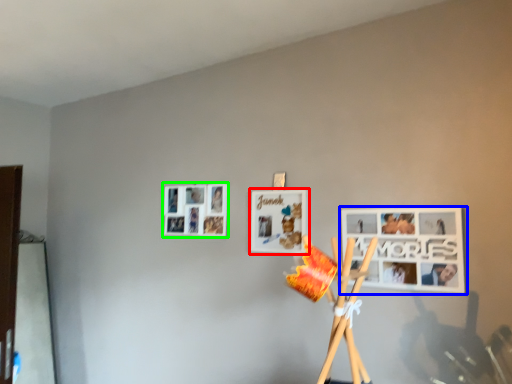
Question: Estimate the real-world distances between objects in this image. Which object is farther from picture frame (highlighted by a red box), picture frame (highlighted by a blue box) or picture frame (highlighted by a green box)?

Choices:
 (A) picture frame
 (B) picture frame

Answer: (A)